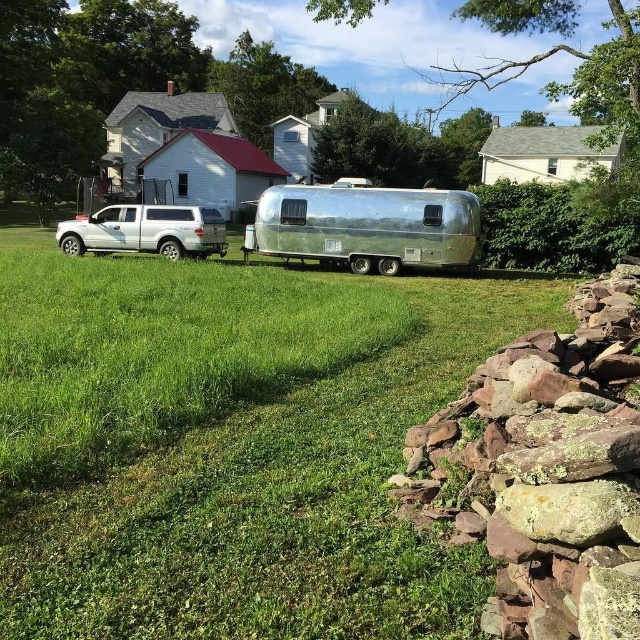
You are planning to install a new garden in the area where the green grass at center and the white matte truck at left are located. Which area has more space available for planting?

The green grass at center has more space available for planting because it is larger in size than the white matte truck at left.

You are planning to move the silver metallic trailer at center and the white matte truck at left into a storage facility. The storage space has a maximum height clearance of 2 meters. Can both vehicles fit through the entrance without any modifications?

The silver metallic trailer at center has a smaller size compared to white matte truck at left, but the height of both vehicles is not provided in the description. Therefore, it is impossible to determine if they can fit through the 2 meter height clearance without additional information.